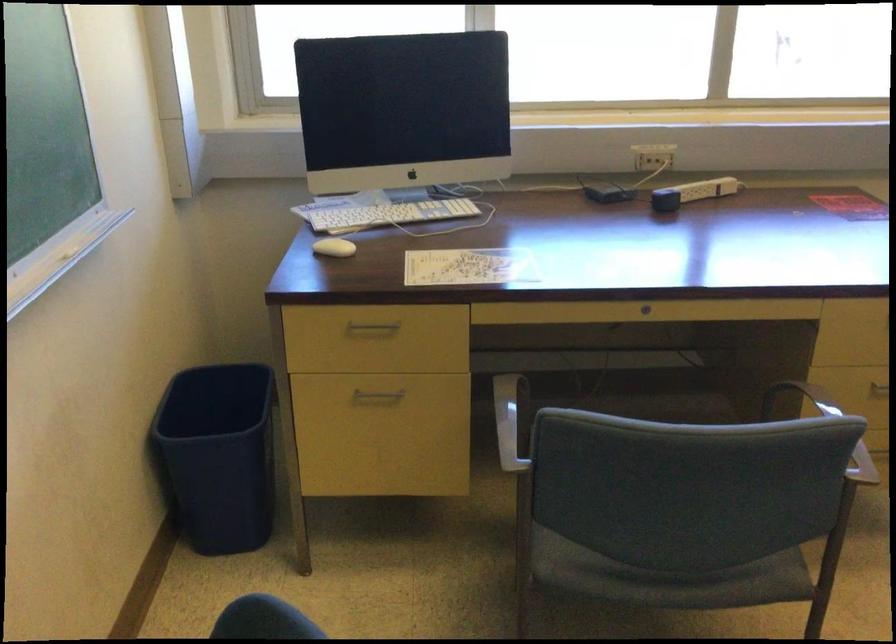
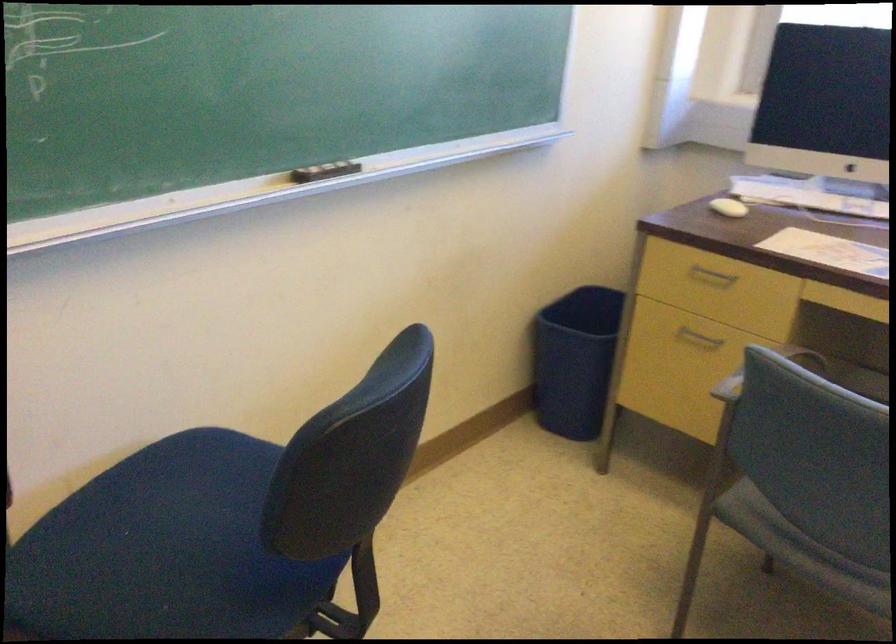
Where in the second image is the point corresponding to (x=561, y=431) from the first image?

(764, 371)